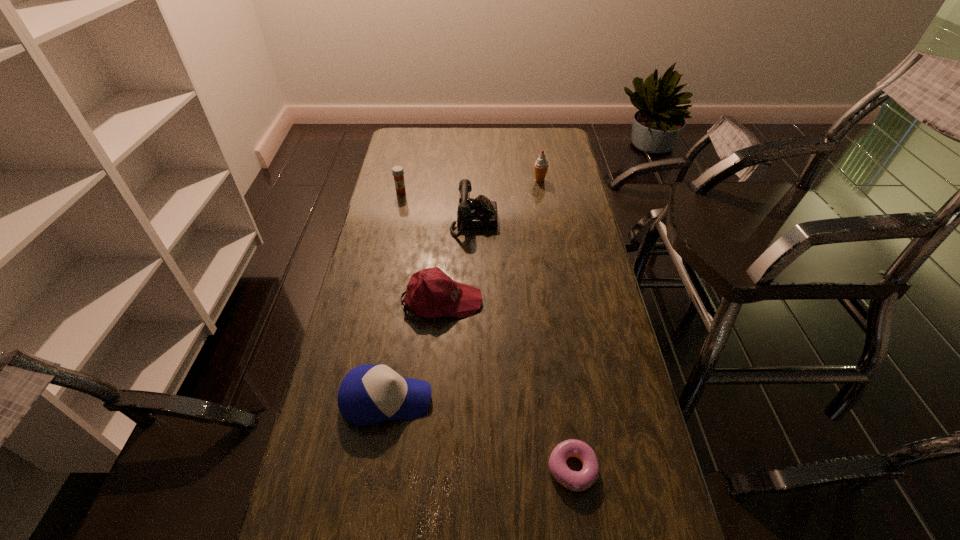
Locate an element on the screen. free space that satisfies the following two spatial constraints: 1. at the front of the shortest object with the brim; 2. on the right side of the farther baseball cap is located at coordinates (428, 469).

Image resolution: width=960 pixels, height=540 pixels. I want to click on free spot that satisfies the following two spatial constraints: 1. at the front of the nearest object with the brim; 2. on the right side of the third nearest object, so click(x=428, y=469).

Locate an element on the screen. This screenshot has height=540, width=960. free spot that satisfies the following two spatial constraints: 1. on the back side of the icecream; 2. on the left side of the doughnut is located at coordinates (531, 180).

Where is `vacant region that satisfies the following two spatial constraints: 1. at the front of the doughnut with the brim; 2. on the right side of the farther baseball cap`? Image resolution: width=960 pixels, height=540 pixels. vacant region that satisfies the following two spatial constraints: 1. at the front of the doughnut with the brim; 2. on the right side of the farther baseball cap is located at coordinates point(428,469).

Find the location of `free space that satisfies the following two spatial constraints: 1. at the front of the third nearest object with the brim; 2. on the left side of the nearest object`. free space that satisfies the following two spatial constraints: 1. at the front of the third nearest object with the brim; 2. on the left side of the nearest object is located at coordinates (428, 469).